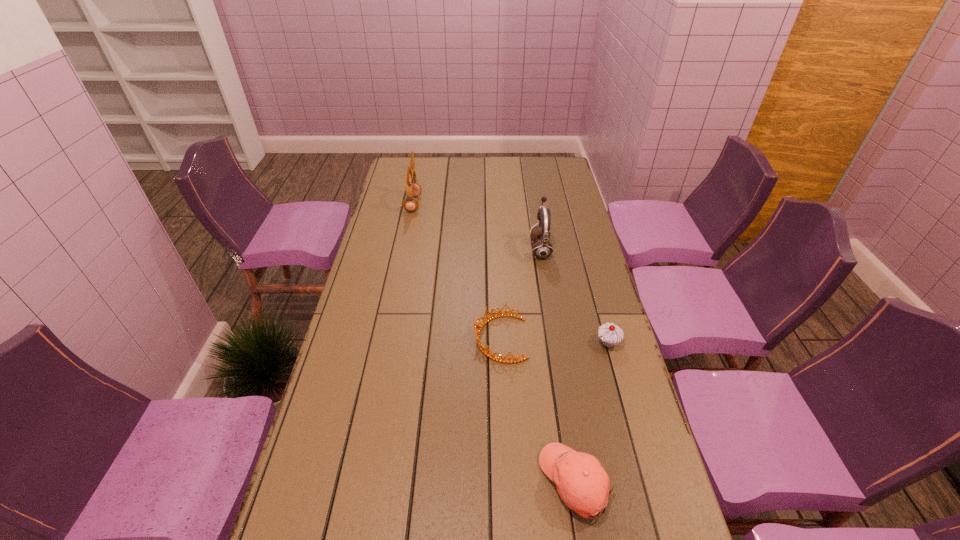
Locate an element on the screen. The width and height of the screenshot is (960, 540). empty space that is in between the nearest object and the fourth nearest object is located at coordinates (558, 366).

Where is `empty space between the right earphone and the third tallest object`? The image size is (960, 540). empty space between the right earphone and the third tallest object is located at coordinates (574, 296).

Identify the location of vacant space that is in between the nearer earphone and the baseball cap. (558, 366).

Image resolution: width=960 pixels, height=540 pixels. Identify the location of free point between the nearest object and the nearer earphone. (558, 366).

Identify the location of free space between the leftmost object and the shortest object. The width and height of the screenshot is (960, 540). point(457,271).

Select which object is the third closest to the right earphone. Please provide its 2D coordinates. Your answer should be formatted as a tuple, i.e. [(x, y)], where the tuple contains the x and y coordinates of a point satisfying the conditions above.

[(413, 189)]

Choose which object is the third nearest neighbor to the nearest object. Please provide its 2D coordinates. Your answer should be formatted as a tuple, i.e. [(x, y)], where the tuple contains the x and y coordinates of a point satisfying the conditions above.

[(542, 249)]

What are the coordinates of `vacant position in the image that satisfies the following two spatial constraints: 1. on the front-facing side of the cupcake; 2. on the left side of the farther earphone` in the screenshot? It's located at (385, 343).

Where is `vacant space that satisfies the following two spatial constraints: 1. on the ear pads of the rightmost object; 2. on the right side of the nearer earphone`? Image resolution: width=960 pixels, height=540 pixels. vacant space that satisfies the following two spatial constraints: 1. on the ear pads of the rightmost object; 2. on the right side of the nearer earphone is located at coordinates (556, 343).

Image resolution: width=960 pixels, height=540 pixels. What are the coordinates of `vacant space that satisfies the following two spatial constraints: 1. on the front-facing side of the leftmost object; 2. on the back side of the nearest object` in the screenshot? It's located at (356, 482).